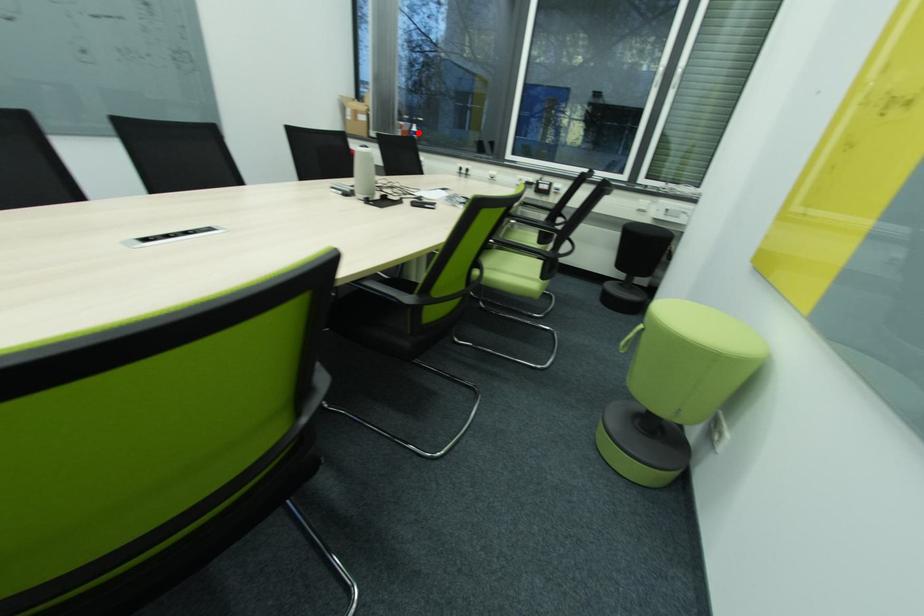
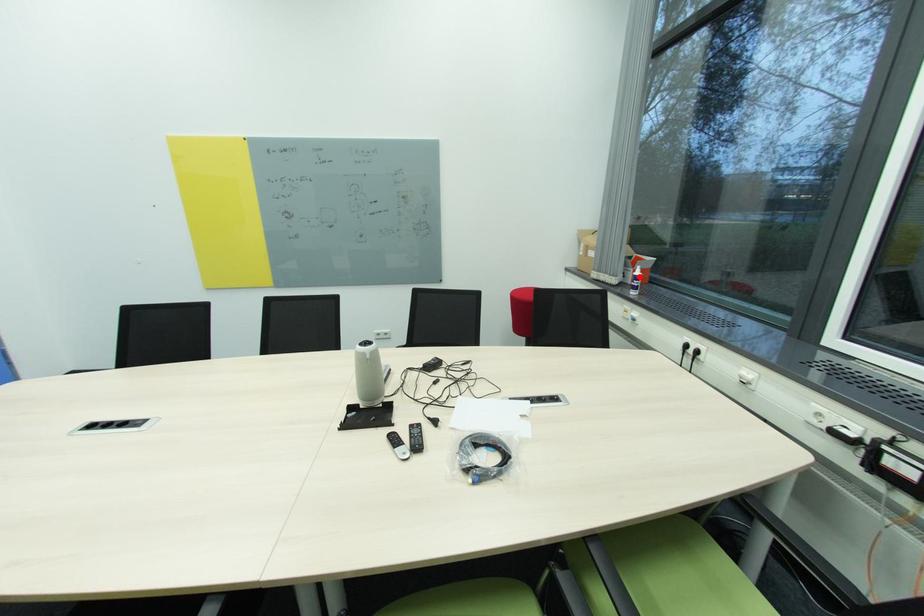
I am providing you with two images of the same scene from different viewpoints. A red point is marked on the first image and another point is marked on the second image. Is the marked point in image1 the same physical position as the marked point in image2?

Yes